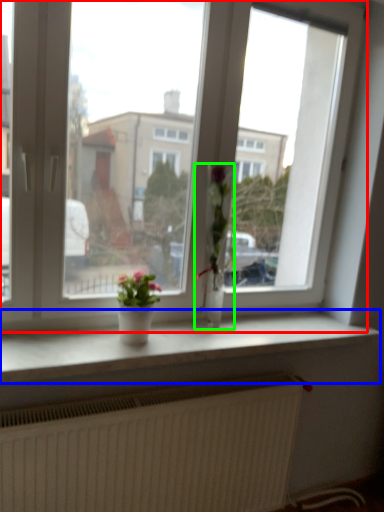
Question: Which is farther away from window (highlighted by a red box)? window sill (highlighted by a blue box) or houseplant (highlighted by a green box)?

Choices:
 (A) window sill
 (B) houseplant

Answer: (A)